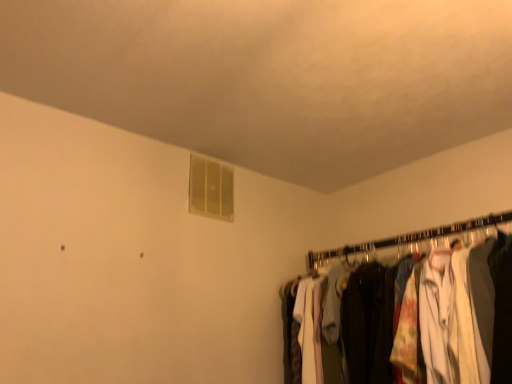
The height and width of the screenshot is (384, 512). In order to click on translucent plastic window at upper center in this screenshot , I will do `click(211, 189)`.

This screenshot has width=512, height=384. What do you see at coordinates (211, 189) in the screenshot?
I see `translucent plastic window at upper center` at bounding box center [211, 189].

Image resolution: width=512 pixels, height=384 pixels. What do you see at coordinates (408, 241) in the screenshot? I see `white fabric clothes at right` at bounding box center [408, 241].

The height and width of the screenshot is (384, 512). In order to click on white fabric clothes at right in this screenshot , I will do `click(408, 241)`.

In order to face white fabric clothes at right, should I rotate leftwards or rightwards?

It's best to rotate right around 17.573 degrees.

You are a GUI agent. You are given a task and a screenshot of the screen. Output one action in this format:
    pyautogui.click(x=<x>, y=<y>)
    Task: Click on the translucent plastic window at upper center
    This screenshot has height=384, width=512.
    Given the screenshot: What is the action you would take?
    click(x=211, y=189)

Which object is positioned more to the left, translucent plastic window at upper center or white fabric clothes at right?

translucent plastic window at upper center.

Based on the photo, which is in front, translucent plastic window at upper center or white fabric clothes at right?

white fabric clothes at right is in front.

In the scene shown: Which is farther, [231,221] or [475,235]?

The point [231,221] is more distant.

From the image's perspective, would you say translucent plastic window at upper center is shown under white fabric clothes at right?

No, from the image's perspective, translucent plastic window at upper center is not beneath white fabric clothes at right.

From a real-world perspective, is translucent plastic window at upper center physically above white fabric clothes at right?

Yes.

Is translucent plastic window at upper center wider than white fabric clothes at right?

In fact, translucent plastic window at upper center might be narrower than white fabric clothes at right.

Does translucent plastic window at upper center have a greater height compared to white fabric clothes at right?

No.

Is translucent plastic window at upper center smaller than white fabric clothes at right?

Yes, translucent plastic window at upper center is smaller than white fabric clothes at right.

In the scene shown: Is white fabric clothes at right a part of translucent plastic window at upper center?

No, white fabric clothes at right is not surrounded by translucent plastic window at upper center.

Is there a large distance between translucent plastic window at upper center and white fabric clothes at right?

No, translucent plastic window at upper center is in close proximity to white fabric clothes at right.

Is translucent plastic window at upper center looking in the opposite direction of white fabric clothes at right?

translucent plastic window at upper center is not turned away from white fabric clothes at right.

Can you tell me how much translucent plastic window at upper center and white fabric clothes at right differ in facing direction?

They differ by 85.9 degrees in their facing directions.

How distant is translucent plastic window at upper center from white fabric clothes at right?

The distance of translucent plastic window at upper center from white fabric clothes at right is 26.85 inches.

This screenshot has height=384, width=512. Find the location of `window located above the white fabric clothes at right (from the image's perspective)`. window located above the white fabric clothes at right (from the image's perspective) is located at coordinates (211, 189).

Considering the positions of objects white fabric clothes at right and translucent plastic window at upper center in the image provided, who is more to the right, white fabric clothes at right or translucent plastic window at upper center?

white fabric clothes at right.

Is white fabric clothes at right further to the viewer compared to translucent plastic window at upper center?

That is False.

Does point (345, 253) appear closer or farther from the camera than point (212, 175)?

Clearly, point (345, 253) is more distant from the camera than point (212, 175).

From the image's perspective, is white fabric clothes at right located above or below translucent plastic window at upper center?

Clearly, from the image's perspective, white fabric clothes at right is below translucent plastic window at upper center.

From a real-world perspective, is white fabric clothes at right positioned under translucent plastic window at upper center based on gravity?

Correct, in the physical world, white fabric clothes at right is lower than translucent plastic window at upper center.

Does white fabric clothes at right have a greater width compared to translucent plastic window at upper center?

Indeed, white fabric clothes at right has a greater width compared to translucent plastic window at upper center.

Is white fabric clothes at right shorter than translucent plastic window at upper center?

Incorrect, the height of white fabric clothes at right does not fall short of that of translucent plastic window at upper center.

Is white fabric clothes at right bigger than translucent plastic window at upper center?

Yes, white fabric clothes at right is bigger than translucent plastic window at upper center.

Is white fabric clothes at right inside or outside of translucent plastic window at upper center?

The correct answer is: outside.

Is white fabric clothes at right not close to translucent plastic window at upper center?

Actually, white fabric clothes at right and translucent plastic window at upper center are a little close together.

Is white fabric clothes at right aimed at translucent plastic window at upper center?

No.

Can you tell me how much white fabric clothes at right and translucent plastic window at upper center differ in facing direction?

The angle between the facing direction of white fabric clothes at right and the facing direction of translucent plastic window at upper center is 85.9 degrees.

The image size is (512, 384). In order to click on closet located in front of the translucent plastic window at upper center in this screenshot , I will do `click(408, 241)`.

Find the location of a particular element. The image size is (512, 384). window above the white fabric clothes at right (from the image's perspective) is located at coordinates (211, 189).

At what (x,y) coordinates should I click in order to perform the action: click on window behind the white fabric clothes at right. Please return your answer as a coordinate pair (x, y). The height and width of the screenshot is (384, 512). Looking at the image, I should click on (211, 189).